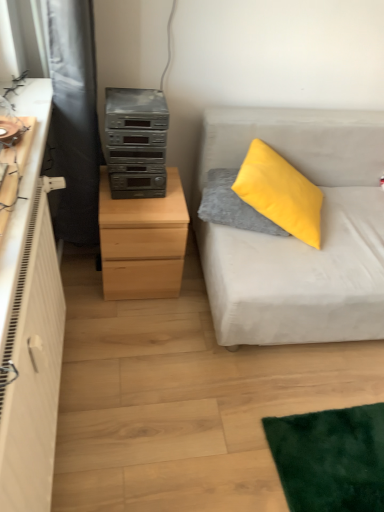
Describe the element at coordinates (143, 242) in the screenshot. I see `light wood chest of drawers at left` at that location.

Image resolution: width=384 pixels, height=512 pixels. Describe the element at coordinates (232, 205) in the screenshot. I see `yellow fuzzy pillow at upper right` at that location.

Find the location of a particular element. light wood chest of drawers at left is located at coordinates (143, 242).

Is yellow fuzzy pillow at upper right far from black fabric curtain at left?

No, yellow fuzzy pillow at upper right is not far away from black fabric curtain at left.

Looking at their sizes, would you say yellow fuzzy pillow at upper right is wider or thinner than black fabric curtain at left?

yellow fuzzy pillow at upper right is wider than black fabric curtain at left.

Considering the positions of objects yellow fuzzy pillow at upper right and black fabric curtain at left in the image provided, who is more to the right, yellow fuzzy pillow at upper right or black fabric curtain at left?

Positioned to the right is yellow fuzzy pillow at upper right.

Considering the positions of objects light wood chest of drawers at left and light gray fabric couch at right in the image provided, who is more to the left, light wood chest of drawers at left or light gray fabric couch at right?

Positioned to the left is light wood chest of drawers at left.

From a real-world perspective, relative to light gray fabric couch at right, is light wood chest of drawers at left vertically above or below?

light wood chest of drawers at left is below light gray fabric couch at right.

This screenshot has width=384, height=512. Find the location of `chest of drawers on the left of light gray fabric couch at right`. chest of drawers on the left of light gray fabric couch at right is located at coordinates (143, 242).

In the scene shown: Does light wood chest of drawers at left touch light gray fabric couch at right?

No, light wood chest of drawers at left is not with light gray fabric couch at right.

Do you think light wood chest of drawers at left is within black fabric curtain at left, or outside of it?

light wood chest of drawers at left is outside black fabric curtain at left.

Is light wood chest of drawers at left far from black fabric curtain at left?

light wood chest of drawers at left is near black fabric curtain at left, not far away.

Is light wood chest of drawers at left wider than black fabric curtain at left?

Yes, light wood chest of drawers at left is wider than black fabric curtain at left.

Between light wood chest of drawers at left and black fabric curtain at left, which one is positioned in front?

black fabric curtain at left.

From a real-world perspective, does black fabric curtain at left sit lower than yellow fuzzy pillow at upper right?

Answer: No.

Can you confirm if black fabric curtain at left is bigger than yellow fuzzy pillow at upper right?

Yes, black fabric curtain at left is bigger than yellow fuzzy pillow at upper right.

Where is `pillow on the right of black fabric curtain at left`? pillow on the right of black fabric curtain at left is located at coordinates (232, 205).

Which is behind, light gray fabric couch at right or yellow fuzzy pillow at upper right?

yellow fuzzy pillow at upper right is more distant.

Considering the relative sizes of light gray fabric couch at right and yellow fuzzy pillow at upper right in the image provided, is light gray fabric couch at right wider than yellow fuzzy pillow at upper right?

Yes.

Can you confirm if light gray fabric couch at right is smaller than yellow fuzzy pillow at upper right?

No, light gray fabric couch at right is not smaller than yellow fuzzy pillow at upper right.

From a real-world perspective, relative to yellow fuzzy pillow at upper right, is light gray fabric couch at right vertically above or below?

From a real-world perspective, light gray fabric couch at right is physically below yellow fuzzy pillow at upper right.

Which object is further away from the camera taking this photo, light gray fabric couch at right or light wood chest of drawers at left?

Positioned behind is light wood chest of drawers at left.

In the scene shown: Would you consider light gray fabric couch at right to be distant from light wood chest of drawers at left?

No.

Considering the positions of objects light gray fabric couch at right and light wood chest of drawers at left in the image provided, who is more to the right, light gray fabric couch at right or light wood chest of drawers at left?

light gray fabric couch at right.

Does light gray fabric couch at right turn towards light wood chest of drawers at left?

No, light gray fabric couch at right is not oriented towards light wood chest of drawers at left.

Which is closer, (74,202) or (134,241)?

Positioned in front is point (134,241).

Considering the sizes of objects black fabric curtain at left and light wood chest of drawers at left in the image provided, who is thinner, black fabric curtain at left or light wood chest of drawers at left?

black fabric curtain at left.

Consider the image. Is light wood chest of drawers at left at the back of black fabric curtain at left?

That's not correct — black fabric curtain at left is not looking away from light wood chest of drawers at left.

From the picture: Considering the positions of objects black fabric curtain at left and light wood chest of drawers at left in the image provided, who is more to the right, black fabric curtain at left or light wood chest of drawers at left?

light wood chest of drawers at left.

The height and width of the screenshot is (512, 384). Find the location of `curtain lying in front of the yellow fuzzy pillow at upper right`. curtain lying in front of the yellow fuzzy pillow at upper right is located at coordinates (74, 118).

You are a GUI agent. You are given a task and a screenshot of the screen. Output one action in this format:
    pyautogui.click(x=<x>, y=<y>)
    Task: Click on the chest of drawers lying below the light gray fabric couch at right (from the image's perspective)
    The image size is (384, 512).
    Given the screenshot: What is the action you would take?
    pyautogui.click(x=143, y=242)

Based on their spatial positions, is yellow fuzzy pillow at upper right or black fabric curtain at left closer to satin silver stereo at center left?

black fabric curtain at left is closer to satin silver stereo at center left.

Based on the photo, which object lies nearer to the anchor point light gray fabric couch at right, black fabric curtain at left or light wood chest of drawers at left?

Based on the image, light wood chest of drawers at left appears to be nearer to light gray fabric couch at right.

Based on their spatial positions, is yellow fuzzy pillow at upper right or black fabric curtain at left closer to light gray fabric couch at right?

yellow fuzzy pillow at upper right lies closer to light gray fabric couch at right than the other object.

When comparing their distances from black fabric curtain at left, does satin silver stereo at center left or yellow fuzzy pillow at upper right seem further?

yellow fuzzy pillow at upper right lies further to black fabric curtain at left than the other object.

Looking at this image, estimate the real-world distances between objects in this image. Which object is closer to yellow fuzzy pillow at upper right, satin silver stereo at center left or light gray fabric couch at right?

light gray fabric couch at right is positioned closer to the anchor yellow fuzzy pillow at upper right.

Considering their positions, is light wood chest of drawers at left positioned further to black fabric curtain at left than satin silver stereo at center left?

light wood chest of drawers at left.

When comparing their distances from light gray fabric couch at right, does satin silver stereo at center left or black fabric curtain at left seem further?

Based on the image, black fabric curtain at left appears to be further to light gray fabric couch at right.

Considering their positions, is satin silver stereo at center left positioned further to light wood chest of drawers at left than yellow fuzzy pillow at upper right?

yellow fuzzy pillow at upper right.

Find the location of a particular element. pillow located between black fabric curtain at left and light gray fabric couch at right in the left-right direction is located at coordinates (232, 205).

You are a GUI agent. You are given a task and a screenshot of the screen. Output one action in this format:
    pyautogui.click(x=<x>, y=<y>)
    Task: Click on the pillow between light wood chest of drawers at left and light gray fabric couch at right
    The height and width of the screenshot is (512, 384).
    Given the screenshot: What is the action you would take?
    pyautogui.click(x=232, y=205)

At what (x,y) coordinates should I click in order to perform the action: click on stereo located between light wood chest of drawers at left and yellow fuzzy pillow at upper right in the left-right direction. Please return your answer as a coordinate pair (x, y). The width and height of the screenshot is (384, 512). Looking at the image, I should click on (136, 142).

Image resolution: width=384 pixels, height=512 pixels. Identify the location of the chest of drawers located between black fabric curtain at left and light gray fabric couch at right in the left-right direction. (143, 242).